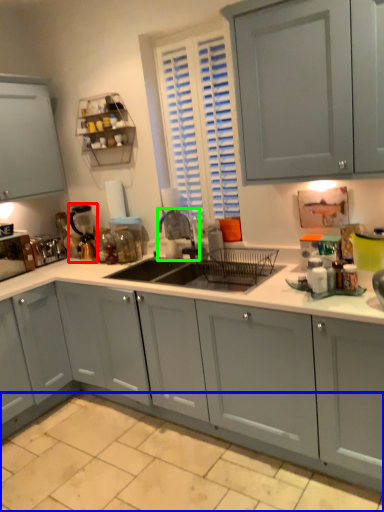
Question: Based on their relative distances, which object is farther from appliance (highlighted by a red box)? Choose from tile (highlighted by a blue box) and faucet (highlighted by a green box).

Choices:
 (A) tile
 (B) faucet

Answer: (A)